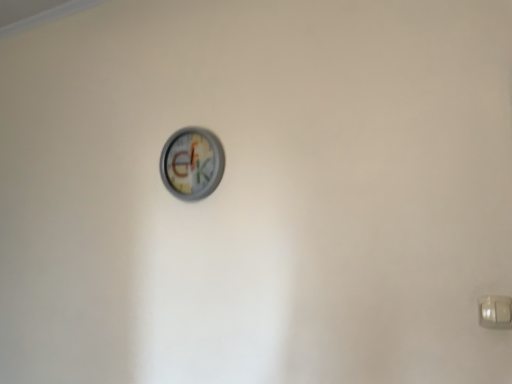
You are a GUI agent. You are given a task and a screenshot of the screen. Output one action in this format:
    pyautogui.click(x=<x>, y=<y>)
    Task: Click on the metallic gray clock at center
    
    Given the screenshot: What is the action you would take?
    pyautogui.click(x=192, y=163)

What do you see at coordinates (192, 163) in the screenshot? I see `metallic gray clock at center` at bounding box center [192, 163].

Measure the distance between metallic gray clock at center and camera.

metallic gray clock at center and camera are 1.46 meters apart.

The height and width of the screenshot is (384, 512). What do you see at coordinates (495, 312) in the screenshot?
I see `white plastic door handle at lower right` at bounding box center [495, 312].

At what (x,y) coordinates should I click in order to perform the action: click on white plastic door handle at lower right. Please return your answer as a coordinate pair (x, y). Looking at the image, I should click on pos(495,312).

Identify the location of metallic gray clock at center. (192, 163).

Considering the positions of objects white plastic door handle at lower right and metallic gray clock at center in the image provided, who is more to the left, white plastic door handle at lower right or metallic gray clock at center?

metallic gray clock at center.

Is the depth of white plastic door handle at lower right less than that of metallic gray clock at center?

Yes, the depth of white plastic door handle at lower right is less than that of metallic gray clock at center.

Is point (493, 307) closer to viewer compared to point (184, 185)?

That is True.

From the image's perspective, is white plastic door handle at lower right located beneath metallic gray clock at center?

Correct, white plastic door handle at lower right appears lower than metallic gray clock at center in the image.

From a real-world perspective, who is located higher, white plastic door handle at lower right or metallic gray clock at center?

From a 3D spatial view, metallic gray clock at center is above.

Looking at their sizes, would you say white plastic door handle at lower right is wider or thinner than metallic gray clock at center?

In the image, white plastic door handle at lower right appears to be more narrow than metallic gray clock at center.

Considering the sizes of objects white plastic door handle at lower right and metallic gray clock at center in the image provided, who is taller, white plastic door handle at lower right or metallic gray clock at center?

metallic gray clock at center.

Is white plastic door handle at lower right bigger than metallic gray clock at center?

Actually, white plastic door handle at lower right might be smaller than metallic gray clock at center.

Is white plastic door handle at lower right surrounding metallic gray clock at center?

No.

Would you consider white plastic door handle at lower right to be distant from metallic gray clock at center?

white plastic door handle at lower right is near metallic gray clock at center, not far away.

Looking at this image, is white plastic door handle at lower right oriented towards metallic gray clock at center?

No, white plastic door handle at lower right is not turned towards metallic gray clock at center.

Can you tell me how much white plastic door handle at lower right and metallic gray clock at center differ in facing direction?

white plastic door handle at lower right and metallic gray clock at center are facing 0.645 degrees away from each other.

Measure the distance between white plastic door handle at lower right and metallic gray clock at center.

→ white plastic door handle at lower right is 96.08 centimeters away from metallic gray clock at center.

Locate an element on the screen. wall clock behind the white plastic door handle at lower right is located at coordinates (192, 163).

Between metallic gray clock at center and white plastic door handle at lower right, which one appears on the right side from the viewer's perspective?

white plastic door handle at lower right.

Is the position of metallic gray clock at center less distant than that of white plastic door handle at lower right?

No, metallic gray clock at center is further to the viewer.

Is point (201, 161) less distant than point (486, 316)?

No, (201, 161) is further to viewer.

From the image's perspective, which is above, metallic gray clock at center or white plastic door handle at lower right?

metallic gray clock at center.

From a real-world perspective, is metallic gray clock at center positioned above or below white plastic door handle at lower right?

In terms of real-world spatial position, metallic gray clock at center is above white plastic door handle at lower right.

Considering the sizes of objects metallic gray clock at center and white plastic door handle at lower right in the image provided, who is thinner, metallic gray clock at center or white plastic door handle at lower right?

Thinner between the two is white plastic door handle at lower right.

Between metallic gray clock at center and white plastic door handle at lower right, which one has more height?

Standing taller between the two is metallic gray clock at center.

Can you confirm if metallic gray clock at center is smaller than white plastic door handle at lower right?

No, metallic gray clock at center is not smaller than white plastic door handle at lower right.

Is metallic gray clock at center spatially inside white plastic door handle at lower right, or outside of it?

metallic gray clock at center is spatially situated outside white plastic door handle at lower right.

Would you say metallic gray clock at center is a long distance from white plastic door handle at lower right?

Actually, metallic gray clock at center and white plastic door handle at lower right are a little close together.

Based on the photo, is metallic gray clock at center looking in the opposite direction of white plastic door handle at lower right?

No, metallic gray clock at center's orientation is not away from white plastic door handle at lower right.

At what (x,y) coordinates should I click in order to perform the action: click on door handle that appears below the metallic gray clock at center (from the image's perspective). Please return your answer as a coordinate pair (x, y). The width and height of the screenshot is (512, 384). Looking at the image, I should click on (495, 312).

At what (x,y) coordinates should I click in order to perform the action: click on wall clock above the white plastic door handle at lower right (from a real-world perspective). Please return your answer as a coordinate pair (x, y). The width and height of the screenshot is (512, 384). Looking at the image, I should click on (192, 163).

Find the location of a particular element. This screenshot has height=384, width=512. door handle in front of the metallic gray clock at center is located at coordinates (495, 312).